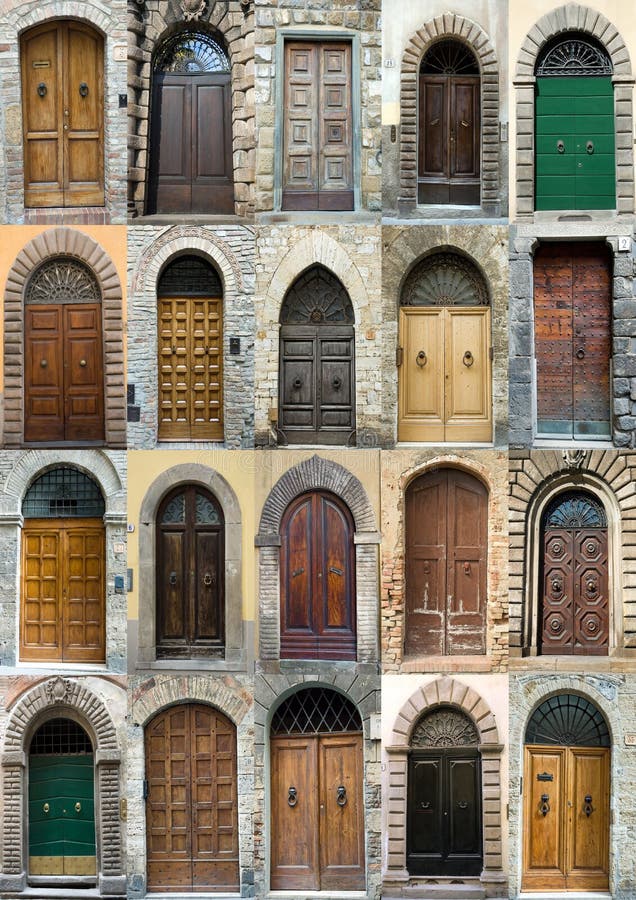
Find the location of a particular element. doors without a transom window is located at coordinates (196, 784), (441, 562), (338, 554), (568, 362), (331, 104), (71, 109).